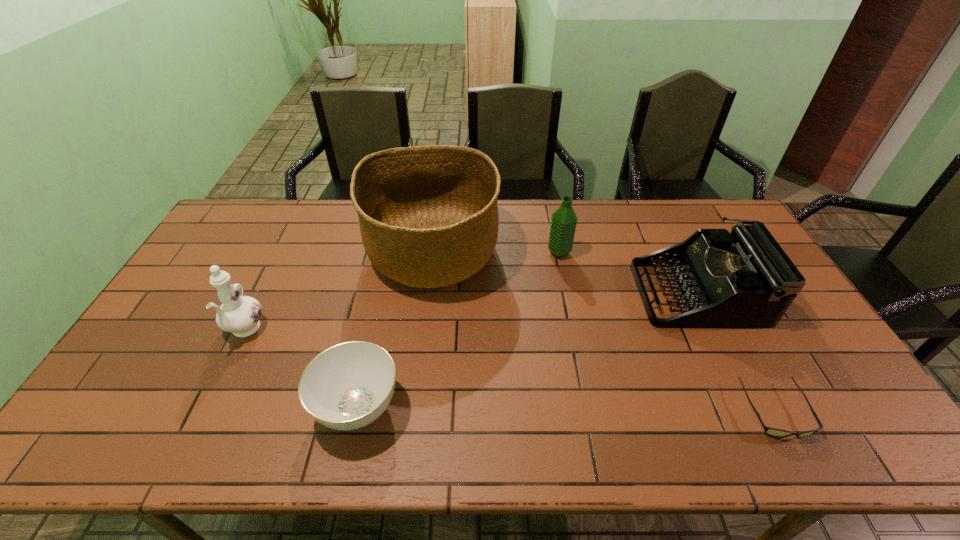
Identify the location of free space between the basket and the water bottle. This screenshot has width=960, height=540. tap(496, 254).

Locate an element on the screen. The image size is (960, 540). unoccupied area between the shortest object and the third shortest object is located at coordinates (736, 352).

You are a GUI agent. You are given a task and a screenshot of the screen. Output one action in this format:
    pyautogui.click(x=<x>, y=<y>)
    Task: Click on the empty location between the tallest object and the fourth tallest object
    The width and height of the screenshot is (960, 540).
    Given the screenshot: What is the action you would take?
    pyautogui.click(x=564, y=273)

Locate an element on the screen. This screenshot has height=540, width=960. vacant point located between the water bottle and the sunglasses is located at coordinates (667, 332).

The height and width of the screenshot is (540, 960). Identify the location of free spot between the shorter chinaware and the leftmost object. (301, 369).

You are a GUI agent. You are given a task and a screenshot of the screen. Output one action in this format:
    pyautogui.click(x=<x>, y=<y>)
    Task: Click on the fifth closest object to the basket
    This screenshot has height=540, width=960.
    Given the screenshot: What is the action you would take?
    pyautogui.click(x=774, y=432)

Select which object appears as the fifth closest to the farther chinaware. Please provide its 2D coordinates. Your answer should be formatted as a tuple, i.e. [(x, y)], where the tuple contains the x and y coordinates of a point satisfying the conditions above.

[(774, 432)]

Where is `free spot that satisfies the following two spatial constraints: 1. at the spout of the leftmost object; 2. on the left side of the shorter chinaware`? The width and height of the screenshot is (960, 540). free spot that satisfies the following two spatial constraints: 1. at the spout of the leftmost object; 2. on the left side of the shorter chinaware is located at coordinates (207, 407).